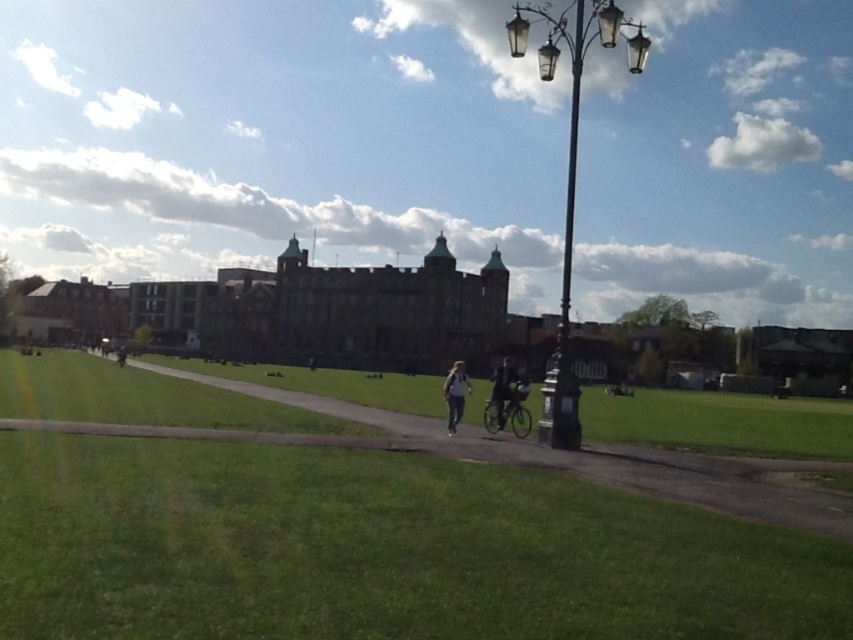
In the scene shown: You are a photographer standing at the edge of the grassy area. You notice two jackets hanging on a rack near the tall streetlamp on the right. Which jacket is closer to the ground, the white fabric jacket at center or the dark gray jacket at center?

The white fabric jacket at center is positioned under the dark gray jacket at center, so the white fabric jacket at center is closer to the ground.